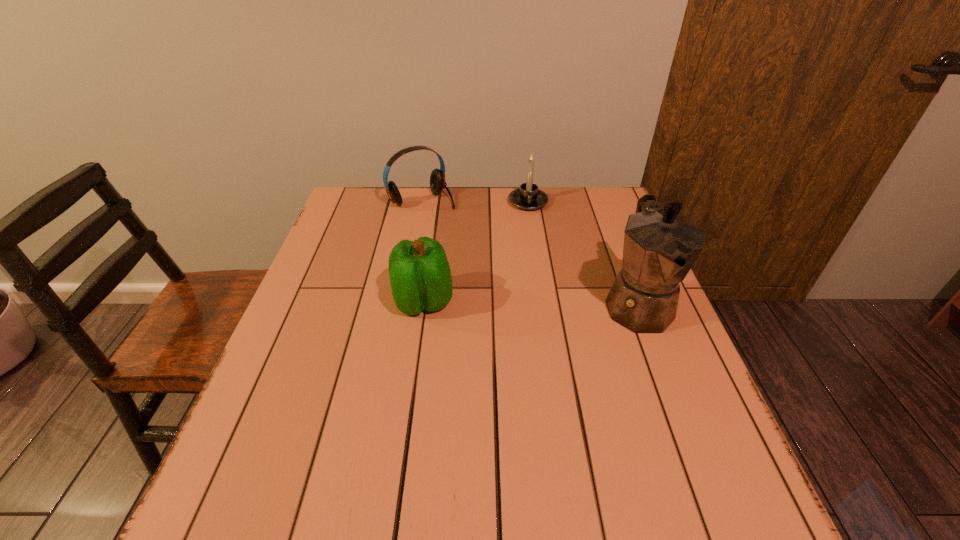
Where is `vacant space on the desktop that is between the bell pepper and the coffeepot and is positioned with a handle on the side of the candle holder`? vacant space on the desktop that is between the bell pepper and the coffeepot and is positioned with a handle on the side of the candle holder is located at coordinates (537, 303).

The image size is (960, 540). Identify the location of free spot on the desktop that is between the bell pepper and the rightmost object and is positioned with the microphone attached to the side of the headset. (520, 303).